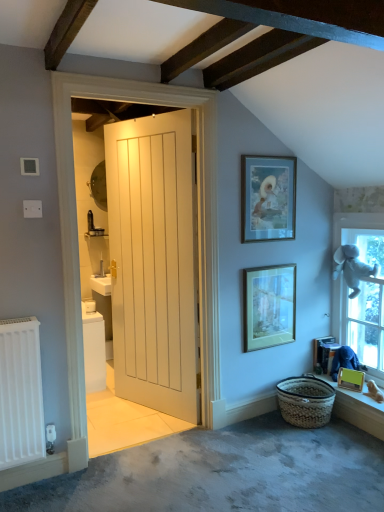
Question: Is matte glass picture frame at center, the 2th picture frame in the top-to-bottom sequence, to the left of wooden changing table at lower right from the viewer's perspective?

Choices:
 (A) no
 (B) yes

Answer: (B)

Question: Is matte glass picture frame at center, the second picture frame from the bottom, shorter than wooden changing table at lower right?

Choices:
 (A) yes
 (B) no

Answer: (B)

Question: From the image's perspective, would you say matte glass picture frame at center, the second picture frame from the bottom, is shown under wooden changing table at lower right?

Choices:
 (A) no
 (B) yes

Answer: (A)

Question: Is matte glass picture frame at center, the 2th picture frame in the top-to-bottom sequence, positioned before wooden changing table at lower right?

Choices:
 (A) no
 (B) yes

Answer: (B)

Question: From the image's perspective, does matte glass picture frame at center, which is the second picture frame from left to right, appear higher than wooden changing table at lower right?

Choices:
 (A) no
 (B) yes

Answer: (B)

Question: From a real-world perspective, is matte glass picture frame at center, which is the 2th picture frame from right to left, positioned under wooden changing table at lower right based on gravity?

Choices:
 (A) yes
 (B) no

Answer: (B)

Question: Does matte yellow picture frame at lower right, which is the 1th picture frame from bottom to top, have a greater height compared to wooden window sill at lower right?

Choices:
 (A) yes
 (B) no

Answer: (A)

Question: Does matte yellow picture frame at lower right, the 3th picture frame in the top-to-bottom sequence, have a smaller size compared to wooden window sill at lower right?

Choices:
 (A) yes
 (B) no

Answer: (A)

Question: Does matte yellow picture frame at lower right, which is the 1th picture frame from bottom to top, have a lesser width compared to wooden window sill at lower right?

Choices:
 (A) yes
 (B) no

Answer: (A)

Question: Is matte yellow picture frame at lower right, the 3th picture frame in the top-to-bottom sequence, wider than wooden window sill at lower right?

Choices:
 (A) yes
 (B) no

Answer: (B)

Question: Is matte yellow picture frame at lower right, which is the 1th picture frame from bottom to top, far away from wooden window sill at lower right?

Choices:
 (A) yes
 (B) no

Answer: (B)

Question: Is the depth of matte yellow picture frame at lower right, acting as the 3th picture frame starting from the left, less than that of wooden window sill at lower right?

Choices:
 (A) yes
 (B) no

Answer: (B)

Question: Is matte glass picture frame at center, which is the second picture frame from left to right, looking in the opposite direction of wooden window sill at lower right?

Choices:
 (A) no
 (B) yes

Answer: (A)